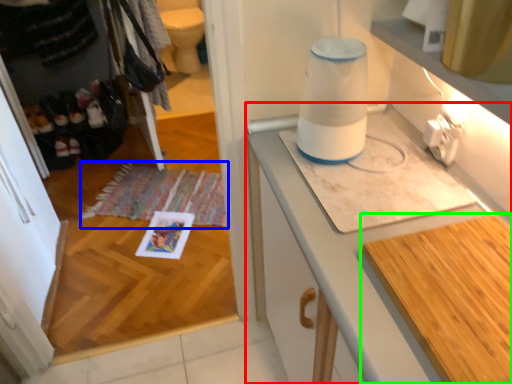
Question: Which is farther away from cabinetry (highlighted by a red box)? mat (highlighted by a blue box) or countertop (highlighted by a green box)?

Choices:
 (A) mat
 (B) countertop

Answer: (A)